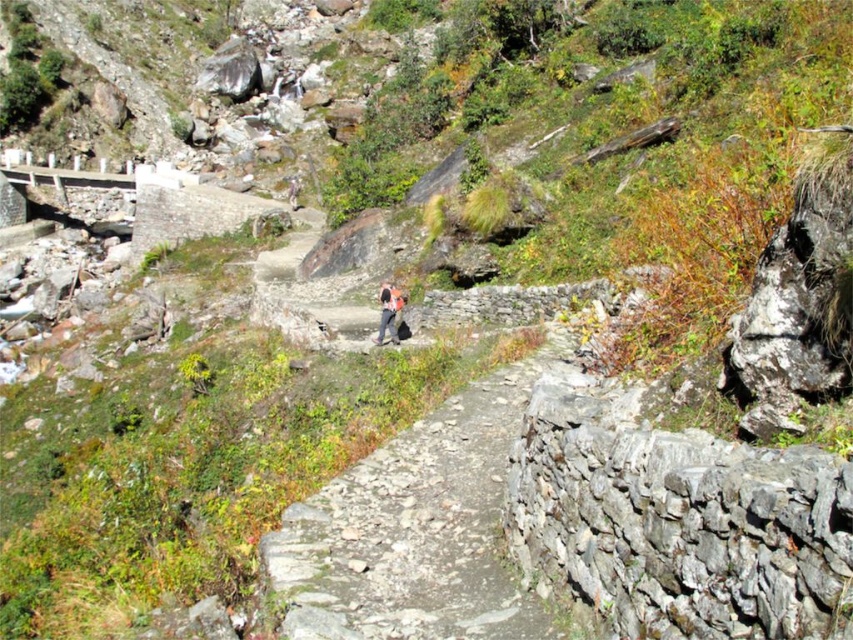
Question: Does gray stone path at center appear over camouflage fabric backpack at center?

Choices:
 (A) no
 (B) yes

Answer: (A)

Question: Which of the following is the farthest from the observer?

Choices:
 (A) (360, 627)
 (B) (399, 296)

Answer: (B)

Question: Considering the relative positions of gray stone path at center and camouflage fabric backpack at center in the image provided, where is gray stone path at center located with respect to camouflage fabric backpack at center?

Choices:
 (A) below
 (B) above

Answer: (A)

Question: Can you confirm if gray stone path at center is positioned above camouflage fabric backpack at center?

Choices:
 (A) yes
 (B) no

Answer: (B)

Question: Among these objects, which one is nearest to the camera?

Choices:
 (A) camouflage fabric backpack at center
 (B) gray stone path at center

Answer: (B)